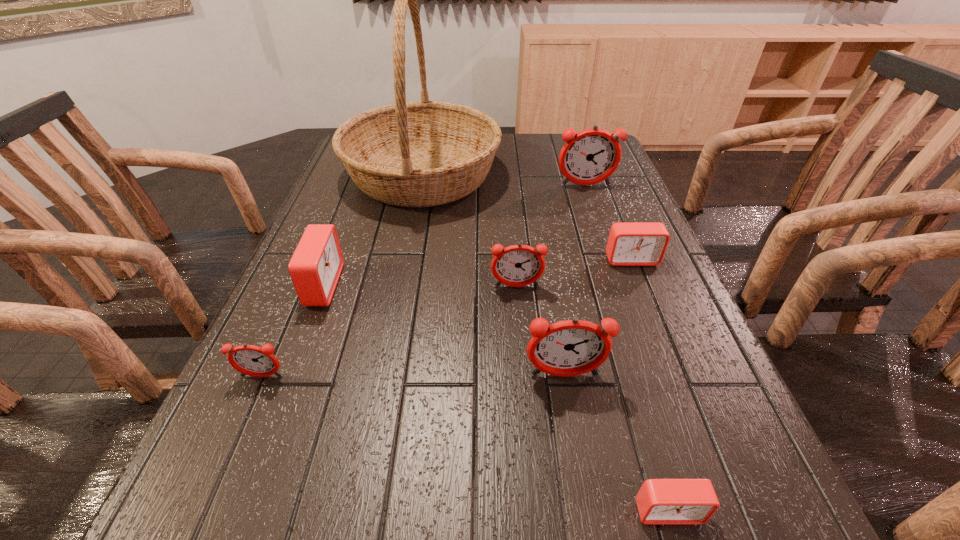
Identify the location of basket. (424, 153).

Where is `the farthest alarm clock`? the farthest alarm clock is located at coordinates (588, 157).

The height and width of the screenshot is (540, 960). I want to click on the farthest reddish-pink alarm clock, so click(x=588, y=157).

Locate an element on the screen. This screenshot has height=540, width=960. the second tallest alarm clock is located at coordinates (573, 347).

In order to click on the third smallest reddish-pink alarm clock in this screenshot , I will do `click(573, 347)`.

Find the location of a particular element. This screenshot has width=960, height=540. the second farthest reddish-pink alarm clock is located at coordinates (519, 265).

At what (x,y) coordinates should I click in order to perform the action: click on the leftmost red alarm clock. Please return your answer as a coordinate pair (x, y). This screenshot has height=540, width=960. Looking at the image, I should click on (315, 267).

Find the location of `the second biggest red alarm clock`. the second biggest red alarm clock is located at coordinates (629, 244).

What are the coordinates of `the leftmost reddish-pink alarm clock` in the screenshot? It's located at (251, 360).

The image size is (960, 540). I want to click on the nearest object, so click(x=659, y=501).